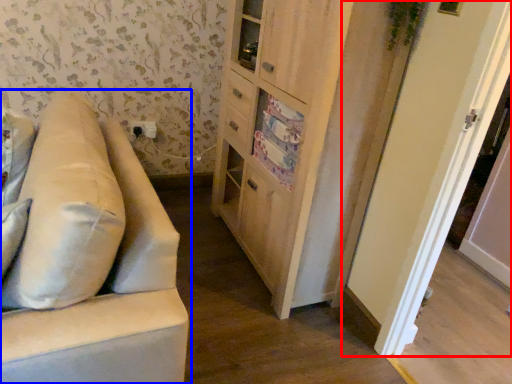
Question: Among these objects, which one is nearest to the camera, door (highlighted by a red box) or studio couch (highlighted by a blue box)?

Choices:
 (A) door
 (B) studio couch

Answer: (B)